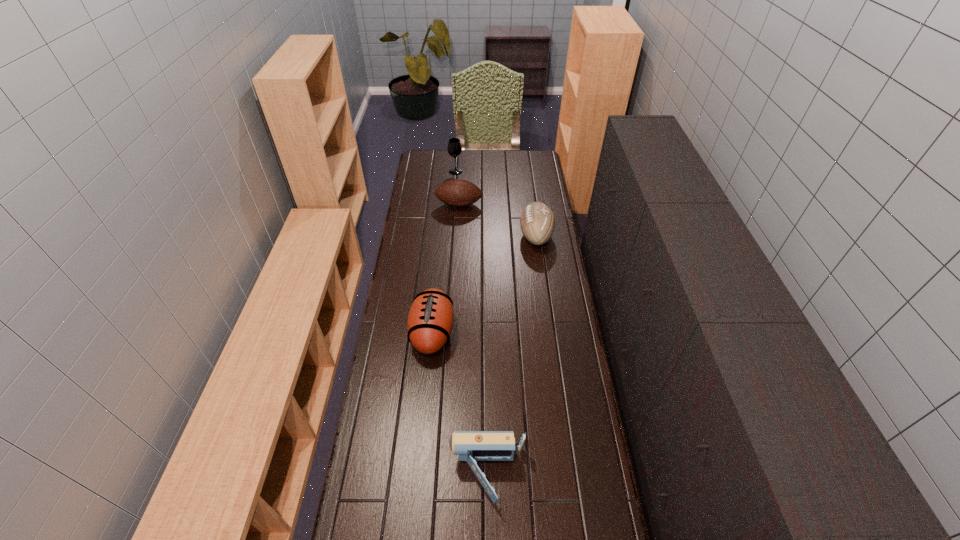
In the image, there is a desktop. Where is `vacant space at the far right corner`? vacant space at the far right corner is located at coordinates (535, 151).

This screenshot has width=960, height=540. Find the location of `empty location between the fourth farthest object and the wineglass`. empty location between the fourth farthest object and the wineglass is located at coordinates pyautogui.click(x=444, y=252).

I want to click on vacant area between the camcorder and the second farthest football, so click(x=512, y=356).

Where is `free space between the farthest object and the fourth farthest object`? Image resolution: width=960 pixels, height=540 pixels. free space between the farthest object and the fourth farthest object is located at coordinates (444, 252).

Locate an element on the screen. This screenshot has width=960, height=540. vacant area that lies between the second nearest object and the second farthest football is located at coordinates (484, 284).

The height and width of the screenshot is (540, 960). I want to click on object that stands as the fourth closest to the second nearest object, so click(x=454, y=148).

This screenshot has width=960, height=540. What are the coordinates of `the closest object to the rightmost football` in the screenshot? It's located at (458, 193).

Identify which football is the third nearest to the nearest object. Please provide its 2D coordinates. Your answer should be formatted as a tuple, i.e. [(x, y)], where the tuple contains the x and y coordinates of a point satisfying the conditions above.

[(458, 193)]

Locate which football ranks second in proximity to the farthest football. Please provide its 2D coordinates. Your answer should be formatted as a tuple, i.e. [(x, y)], where the tuple contains the x and y coordinates of a point satisfying the conditions above.

[(430, 321)]

Find the location of `blank area in the image that satisfies the following two spatial constraints: 1. on the back side of the wineglass; 2. on the right side of the nearest football`. blank area in the image that satisfies the following two spatial constraints: 1. on the back side of the wineglass; 2. on the right side of the nearest football is located at coordinates click(x=447, y=172).